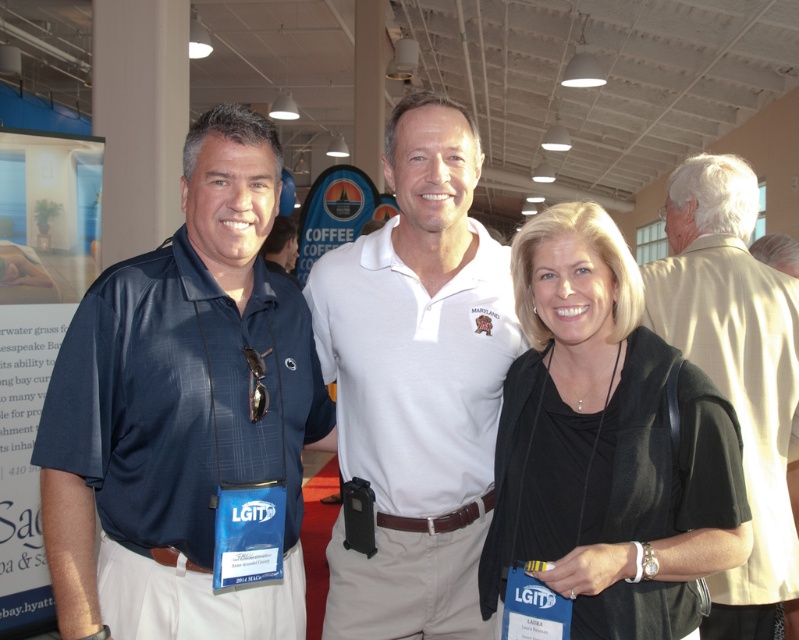
You are at a professional event and need to locate the person wearing the white cotton polo shirt at center. According to the coordinates provided, where exactly is this individual positioned relative to the image frame?

The white cotton polo shirt at center is positioned at coordinates point 0.600 on the x axis and 0.522 on the y axis within the image frame.

You are at a networking event and want to approach the person wearing the beige textured shirt at upper right. The person wearing the matte blue shirt at center is blocking your path. Can you walk around them to reach your target?

The matte blue shirt at center is located above the beige textured shirt at upper right, meaning the person in the matte blue shirt is closer to you. Since they are blocking your path, you can walk around them to reach the person in the beige textured shirt at upper right.

You are attending a networking event and notice two individuals wearing shirts of different colors. The first person is wearing a matte blue shirt at center, and the second is wearing a black matte shirt at center. From your perspective, which shirt is covering part of the other?

The matte blue shirt at center is positioned over the black matte shirt at center, so it is covering part of the black matte shirt at center.